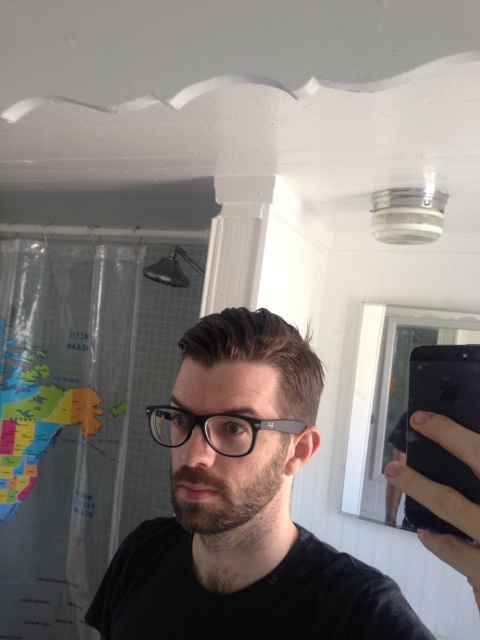
Does matte black glasses at center appear on the right side of black plastic glasses at center?

Indeed, matte black glasses at center is positioned on the right side of black plastic glasses at center.

Is matte black glasses at center closer to camera compared to black plastic glasses at center?

Yes.

Does point (226, 339) come farther from viewer compared to point (282, 420)?

No, (226, 339) is in front of (282, 420).

Locate an element on the screen. Image resolution: width=480 pixels, height=640 pixels. matte black glasses at center is located at coordinates pyautogui.click(x=241, y=508).

Looking at this image, between matte black glasses at center and black matte smartphone at upper right, which one is positioned higher?

black matte smartphone at upper right is above.

Which is more to the left, matte black glasses at center or black matte smartphone at upper right?

From the viewer's perspective, matte black glasses at center appears more on the left side.

Locate an element on the screen. This screenshot has width=480, height=640. matte black glasses at center is located at coordinates (241, 508).

From the picture: How distant is black matte smartphone at upper right from black plastic glasses at center?

They are 6.71 inches apart.

The height and width of the screenshot is (640, 480). In order to click on black matte smartphone at upper right in this screenshot , I will do `click(444, 410)`.

You are a GUI agent. You are given a task and a screenshot of the screen. Output one action in this format:
    pyautogui.click(x=<x>, y=<y>)
    Task: Click on the black matte smartphone at upper right
    The height and width of the screenshot is (640, 480).
    Given the screenshot: What is the action you would take?
    pyautogui.click(x=444, y=410)